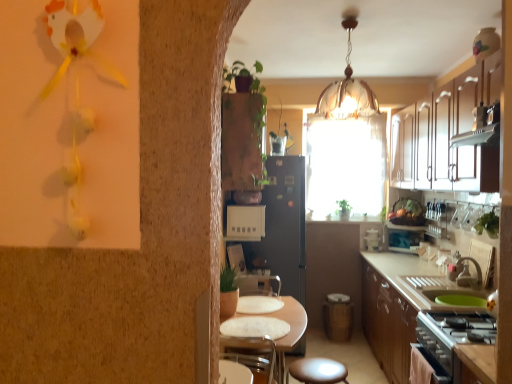
Question: Are green leafy plant at right, the 1th plant positioned from the right, and black matte refrigerator at center making contact?

Choices:
 (A) no
 (B) yes

Answer: (A)

Question: From a real-world perspective, does green leafy plant at right, placed as the 2th plant when sorted from back to front, stand above black matte refrigerator at center?

Choices:
 (A) no
 (B) yes

Answer: (B)

Question: Is green leafy plant at right, the 2th plant positioned from the top, positioned in front of black matte refrigerator at center?

Choices:
 (A) no
 (B) yes

Answer: (B)

Question: Is green leafy plant at right, the 1th plant positioned from the right, shorter than black matte refrigerator at center?

Choices:
 (A) yes
 (B) no

Answer: (A)

Question: From a real-world perspective, is green leafy plant at right, marked as the first plant in a front-to-back arrangement, under black matte refrigerator at center?

Choices:
 (A) no
 (B) yes

Answer: (A)

Question: Which is correct: beige plastic electrical outlet at center, which is the second appliance from right to left, is inside green plastic sink at lower right, or outside of it?

Choices:
 (A) inside
 (B) outside

Answer: (B)

Question: In terms of height, does beige plastic electrical outlet at center, which is the second appliance from right to left, look taller or shorter compared to green plastic sink at lower right?

Choices:
 (A) short
 (B) tall

Answer: (B)

Question: From a real-world perspective, relative to green plastic sink at lower right, is beige plastic electrical outlet at center, the 1th appliance positioned from the left, vertically above or below?

Choices:
 (A) below
 (B) above

Answer: (B)

Question: In the image, is beige plastic electrical outlet at center, which appears as the second appliance when viewed from the back, positioned in front of or behind green plastic sink at lower right?

Choices:
 (A) behind
 (B) front

Answer: (A)

Question: Would you say white glossy countertop at lower right is to the left or to the right of matte brown stool at lower center in the picture?

Choices:
 (A) right
 (B) left

Answer: (A)

Question: From a real-world perspective, is white glossy countertop at lower right physically located above or below matte brown stool at lower center?

Choices:
 (A) below
 (B) above

Answer: (B)

Question: Is white glossy countertop at lower right bigger or smaller than matte brown stool at lower center?

Choices:
 (A) small
 (B) big

Answer: (B)

Question: Considering their positions, is white glossy countertop at lower right located in front of or behind matte brown stool at lower center?

Choices:
 (A) front
 (B) behind

Answer: (A)

Question: In the image, is stainless steel stove at lower right positioned in front of or behind white textured table at center?

Choices:
 (A) behind
 (B) front

Answer: (B)

Question: In the image, is stainless steel stove at lower right on the left side or the right side of white textured table at center?

Choices:
 (A) right
 (B) left

Answer: (A)